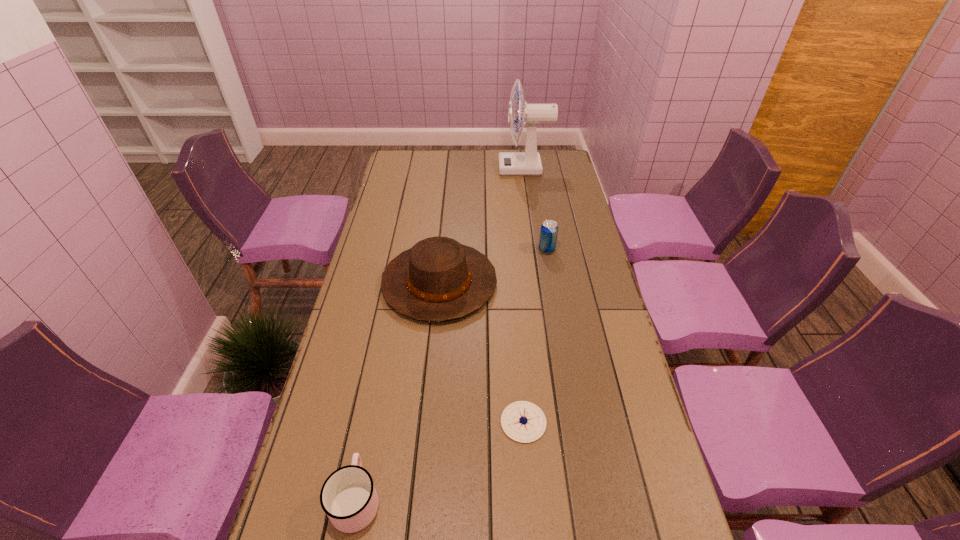
Find the location of a particular element. The image size is (960, 540). free region that satisfies the following two spatial constraints: 1. on the side of the fourth tallest object with the handle; 2. on the right side of the second nearest object is located at coordinates (372, 422).

This screenshot has height=540, width=960. I want to click on free region that satisfies the following two spatial constraints: 1. on the side of the cowboy hat with the handle; 2. on the left side of the nearest object, so click(398, 283).

This screenshot has height=540, width=960. Find the location of `vacant position in the image that satisfies the following two spatial constraints: 1. on the front-facing side of the third shortest object; 2. on the right side of the tallest object`. vacant position in the image that satisfies the following two spatial constraints: 1. on the front-facing side of the third shortest object; 2. on the right side of the tallest object is located at coordinates (537, 250).